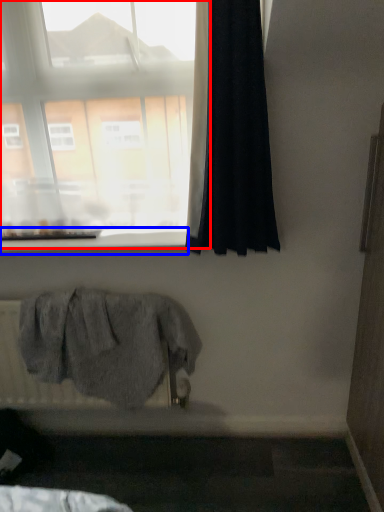
Question: Which point is closer to the camera, window (highlighted by a red box) or window sill (highlighted by a blue box)?

Choices:
 (A) window
 (B) window sill

Answer: (A)